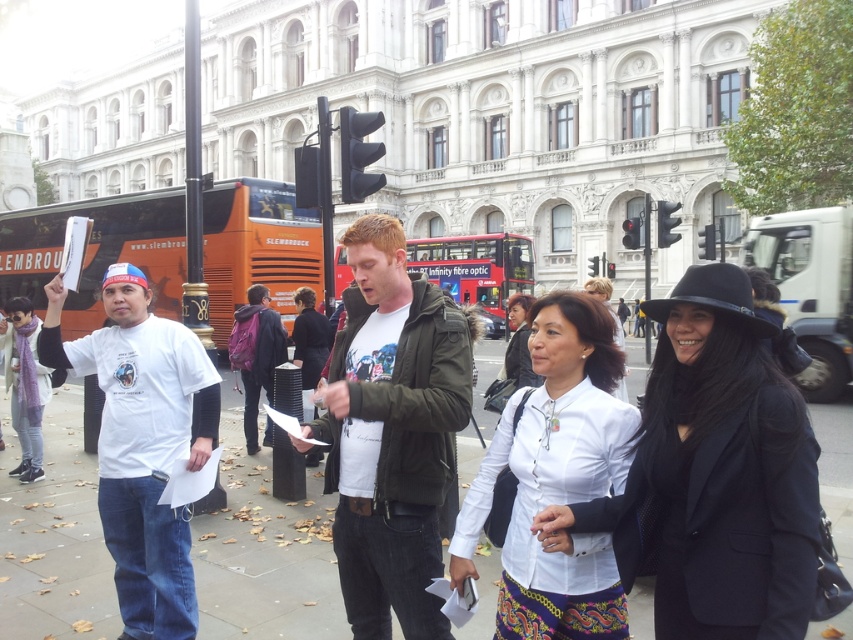
Question: Among these objects, which one is nearest to the camera?

Choices:
 (A) orange matte bus at left
 (B) brown concrete pavement at lower center
 (C) green cotton jacket at center

Answer: (B)

Question: Is brown concrete pavement at lower center bigger than white matte shirt at center?

Choices:
 (A) yes
 (B) no

Answer: (A)

Question: Which point appears closest to the camera in this image?

Choices:
 (A) (140, 232)
 (B) (485, 305)
 (C) (189, 445)

Answer: (C)

Question: Is white t-shirt at left below orange matte bus at left?

Choices:
 (A) yes
 (B) no

Answer: (A)

Question: Does white t-shirt at left have a larger size compared to orange matte bus at left?

Choices:
 (A) yes
 (B) no

Answer: (B)

Question: Which is nearer to the white matte shirt at center?

Choices:
 (A) brown concrete pavement at lower center
 (B) green cotton jacket at center
 (C) black matte hat at center

Answer: (C)